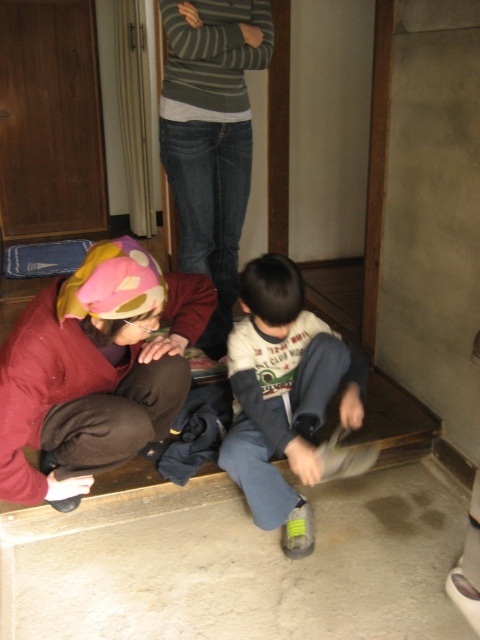
What is located at the coordinates point (211, 138) in the image?

The striped sweater at center is located at point (211, 138).

You are standing in the room and want to pick up the brown fabric at lower left and the white cotton shirt at center. Which one do you need to bend down more to reach?

You need to bend down more to reach the brown fabric at lower left because it is closer to the viewer than the white cotton shirt at center.

You are a visitor in this Japanese home and you see the brown fabric at lower left and the striped sweater at center. Which one is shorter in height?

The brown fabric at lower left is shorter than the striped sweater at center because it is not as tall as the striped sweater at center.